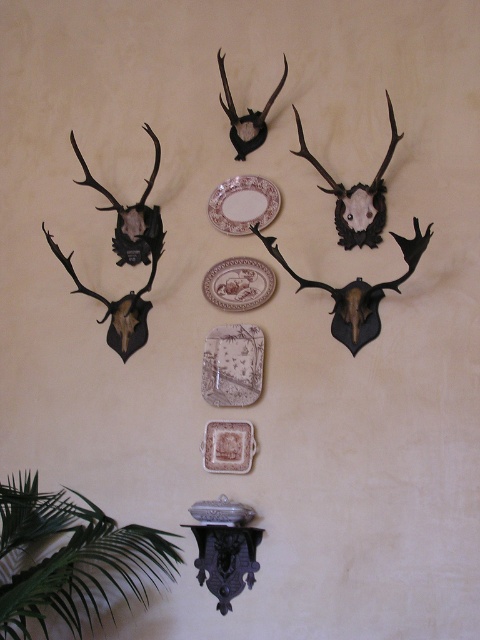
You are an interior designer arranging wall decorations. You have a white glossy plate at upper center and a brown glazed plate at center. Which plate is closer to the viewer?

The white glossy plate at upper center is closer to the viewer because the brown glazed plate at center is behind it.

You are an interior designer assessing the wall display. You need to determine which object is positioned closer to the observer between the brown ceramic plate at center and the black matte antler at upper center. Which one is closer?

The brown ceramic plate at center is closer to the viewer than the black matte antler at upper center according to the description.

You are an interior designer arranging wall decorations. You have a white glossy plate at upper center and a brown glazed plate at center. Which plate is placed higher on the wall?

The white glossy plate at upper center is placed higher than the brown glazed plate at center.